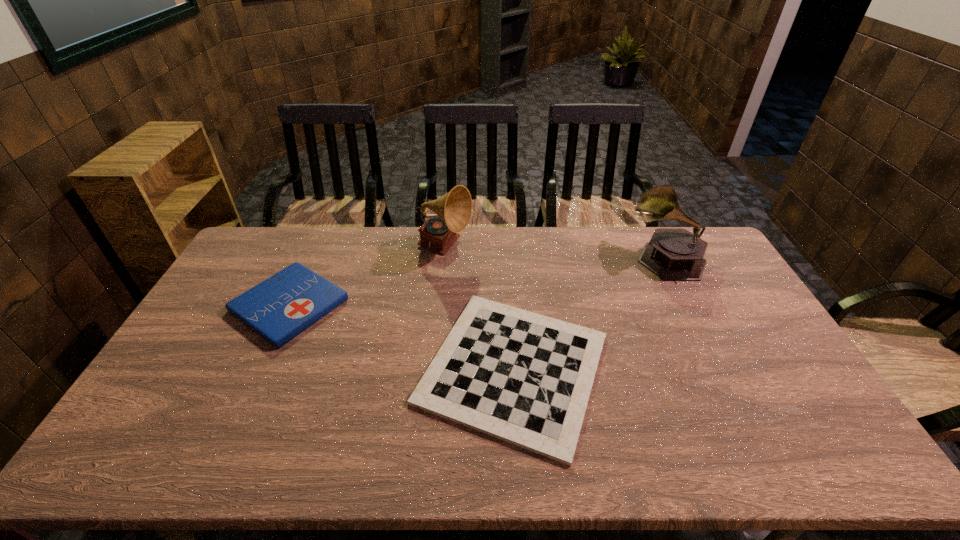
Locate an element on the screen. vacant point located between the left phonograph record and the first-aid kit is located at coordinates (368, 276).

In order to click on empty location between the shortest object and the leftmost object in this screenshot , I will do tap(401, 336).

Locate an element on the screen. vacant region between the shortest object and the right phonograph record is located at coordinates click(589, 313).

You are a GUI agent. You are given a task and a screenshot of the screen. Output one action in this format:
    pyautogui.click(x=<x>, y=<y>)
    Task: Click on the free point between the left phonograph record and the first-aid kit
    This screenshot has width=960, height=540.
    Given the screenshot: What is the action you would take?
    pyautogui.click(x=368, y=276)

Where is `unoccupied position between the right phonograph record and the left phonograph record`? This screenshot has width=960, height=540. unoccupied position between the right phonograph record and the left phonograph record is located at coordinates (556, 253).

Identify the location of free area in between the leftmost object and the right phonograph record. (478, 281).

Choose which object is the nearest neighbor to the second shortest object. Please provide its 2D coordinates. Your answer should be formatted as a tuple, i.e. [(x, y)], where the tuple contains the x and y coordinates of a point satisfying the conditions above.

[(453, 210)]

Identify which object is located as the third nearest to the checkerboard. Please provide its 2D coordinates. Your answer should be formatted as a tuple, i.e. [(x, y)], where the tuple contains the x and y coordinates of a point satisfying the conditions above.

[(278, 309)]

Find the location of a particular element. free space that satisfies the following two spatial constraints: 1. on the front side of the first-aid kit; 2. on the right side of the checkerboard is located at coordinates (260, 368).

Locate an element on the screen. This screenshot has width=960, height=540. free space that satisfies the following two spatial constraints: 1. on the horn direction of the right phonograph record; 2. on the front side of the leftmost object is located at coordinates (690, 305).